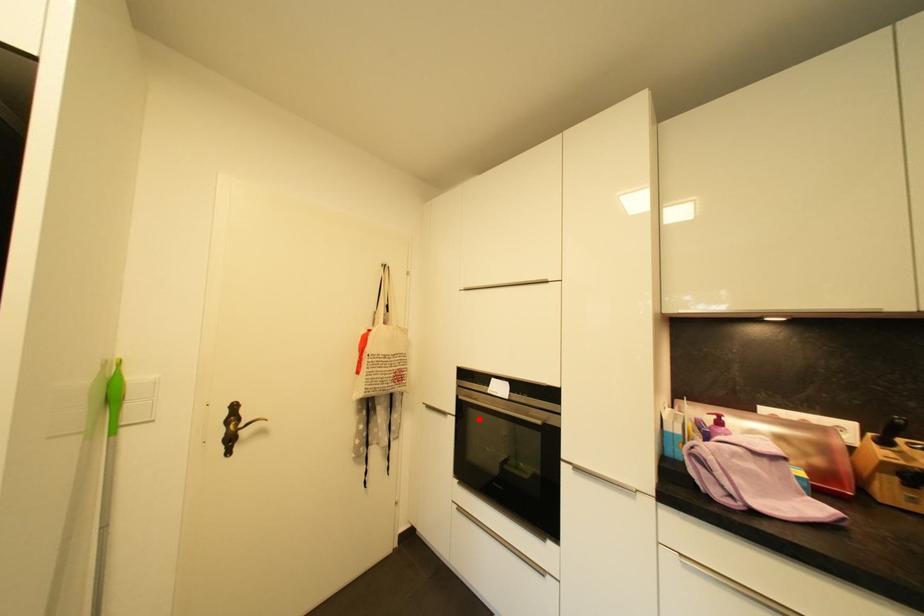
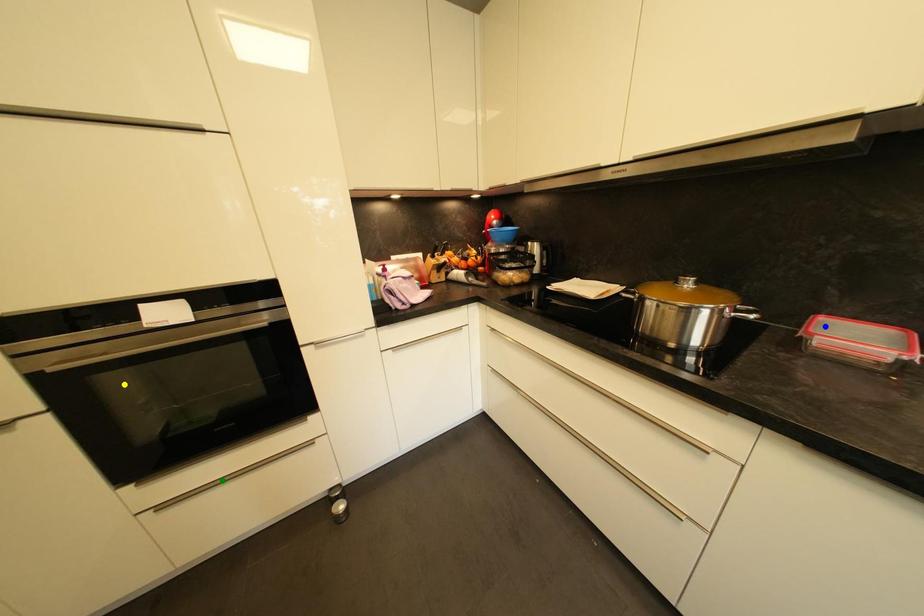
Question: I am providing you with two images of the same scene from different viewpoints. A red point is marked on the first image. You are given multiple points on the second image. In image 2, which mark is for the same physical point as the one in image 1?

Choices:
 (A) green point
 (B) yellow point
 (C) blue point

Answer: (B)